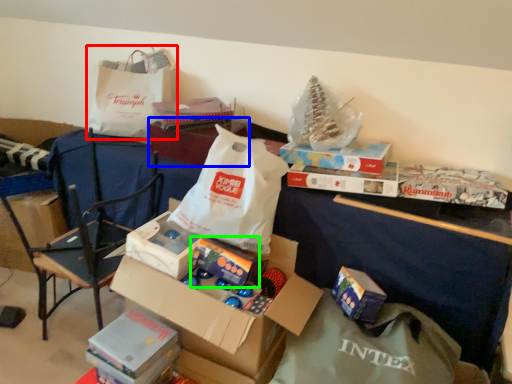
Question: Considering the real-world distances, which object is closest to grocery bag (highlighted by a red box)? storage box (highlighted by a blue box) or gift (highlighted by a green box).

Choices:
 (A) storage box
 (B) gift

Answer: (A)